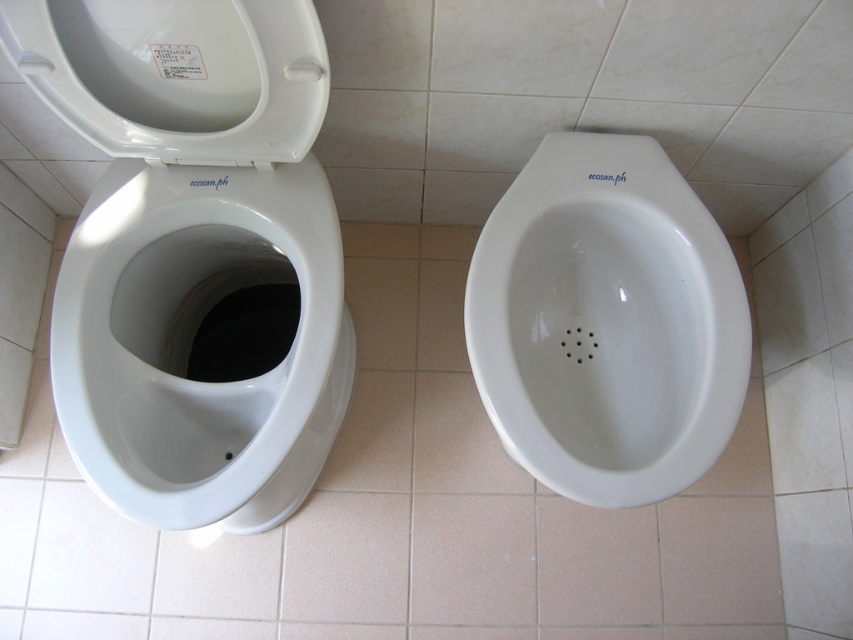
Question: Which point is farther from the camera taking this photo?

Choices:
 (A) (695, 312)
 (B) (62, 45)

Answer: (A)

Question: Considering the relative positions of white glossy toilet bowl at left and white glossy toilet lid at upper left in the image provided, where is white glossy toilet bowl at left located with respect to white glossy toilet lid at upper left?

Choices:
 (A) left
 (B) right

Answer: (A)

Question: Considering the real-world distances, which object is closest to the white glossy toilet bowl at left?

Choices:
 (A) white glossy urinal at center
 (B) white glossy toilet lid at upper left

Answer: (B)

Question: Is the position of white glossy toilet bowl at left less distant than that of white glossy urinal at center?

Choices:
 (A) yes
 (B) no

Answer: (A)

Question: Does white glossy toilet bowl at left have a smaller size compared to white glossy urinal at center?

Choices:
 (A) yes
 (B) no

Answer: (B)

Question: Which object is farther from the camera taking this photo?

Choices:
 (A) white glossy toilet lid at upper left
 (B) white glossy urinal at center

Answer: (B)